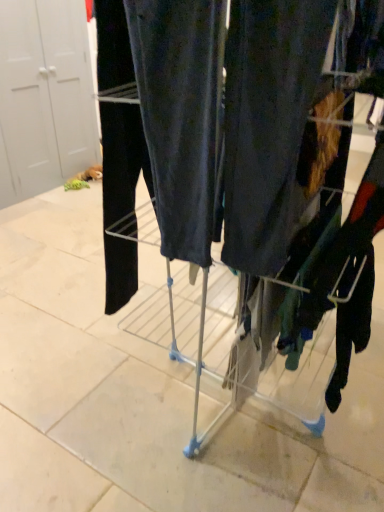
This screenshot has width=384, height=512. I want to click on metallic silver trolley at center, so click(x=259, y=150).

What do you see at coordinates (259, 150) in the screenshot?
I see `metallic silver trolley at center` at bounding box center [259, 150].

Describe the element at coordinates (45, 97) in the screenshot. This screenshot has height=512, width=384. I see `white matte door at left` at that location.

What are the coordinates of `white matte door at left` in the screenshot? It's located at (45, 97).

Locate an element on the screen. The image size is (384, 512). metallic silver trolley at center is located at coordinates (259, 150).

Considering the relative positions of metallic silver trolley at center and white matte door at left in the image provided, is metallic silver trolley at center to the left or to the right of white matte door at left?

Based on their positions, metallic silver trolley at center is located to the right of white matte door at left.

From the picture: Relative to white matte door at left, is metallic silver trolley at center in front or behind?

Clearly, metallic silver trolley at center is in front of white matte door at left.

Is point (375, 191) in front of point (30, 180)?

Yes, it is.

From the image's perspective, who appears lower, metallic silver trolley at center or white matte door at left?

From the image's view, metallic silver trolley at center is below.

From a real-world perspective, which object rests below the other?

In real-world perspective, metallic silver trolley at center is lower.

Between metallic silver trolley at center and white matte door at left, which one has smaller width?

With smaller width is white matte door at left.

Consider the image. In terms of height, does metallic silver trolley at center look taller or shorter compared to white matte door at left?

In the image, metallic silver trolley at center appears to be shorter than white matte door at left.

Considering the relative sizes of metallic silver trolley at center and white matte door at left in the image provided, is metallic silver trolley at center smaller than white matte door at left?

Yes, metallic silver trolley at center is smaller than white matte door at left.

Would you say metallic silver trolley at center is inside or outside white matte door at left?

The correct answer is: outside.

Is there a large distance between metallic silver trolley at center and white matte door at left?

metallic silver trolley at center is positioned a significant distance from white matte door at left.

Is metallic silver trolley at center facing towards white matte door at left?

No, metallic silver trolley at center is not oriented towards white matte door at left.

There is a metallic silver trolley at center. Identify the location of door above it (from a real-world perspective). This screenshot has height=512, width=384. (45, 97).

Would you say white matte door at left is to the left or to the right of metallic silver trolley at center in the picture?

From the image, it's evident that white matte door at left is to the left of metallic silver trolley at center.

Is white matte door at left in front of or behind metallic silver trolley at center in the image?

white matte door at left is behind metallic silver trolley at center.

Which is more distant, (x=28, y=64) or (x=312, y=238)?

The point (x=28, y=64) is more distant.

From the image's perspective, is white matte door at left located beneath metallic silver trolley at center?

Incorrect, from the image's perspective, white matte door at left is higher than metallic silver trolley at center.

From a real-world perspective, who is located higher, white matte door at left or metallic silver trolley at center?

From a 3D spatial view, white matte door at left is above.

Which object is thinner, white matte door at left or metallic silver trolley at center?

white matte door at left.

Considering the relative sizes of white matte door at left and metallic silver trolley at center in the image provided, is white matte door at left shorter than metallic silver trolley at center?

Incorrect, the height of white matte door at left does not fall short of that of metallic silver trolley at center.

Consider the image. In terms of size, does white matte door at left appear bigger or smaller than metallic silver trolley at center?

Clearly, white matte door at left is larger in size than metallic silver trolley at center.

Could metallic silver trolley at center be considered to be inside white matte door at left?

No, white matte door at left does not contain metallic silver trolley at center.

Is white matte door at left touching metallic silver trolley at center?

No, white matte door at left is not touching metallic silver trolley at center.

Is white matte door at left oriented towards metallic silver trolley at center?

Yes, white matte door at left is aimed at metallic silver trolley at center.

How many degrees apart are the facing directions of white matte door at left and metallic silver trolley at center?

The facing directions of white matte door at left and metallic silver trolley at center are 177 degrees apart.

The width and height of the screenshot is (384, 512). I want to click on door above the metallic silver trolley at center (from the image's perspective), so click(x=45, y=97).

This screenshot has height=512, width=384. I want to click on trolley located on the right of white matte door at left, so tap(259, 150).

In the image, there is a white matte door at left. Identify the location of trolley below it (from a real-world perspective). (259, 150).